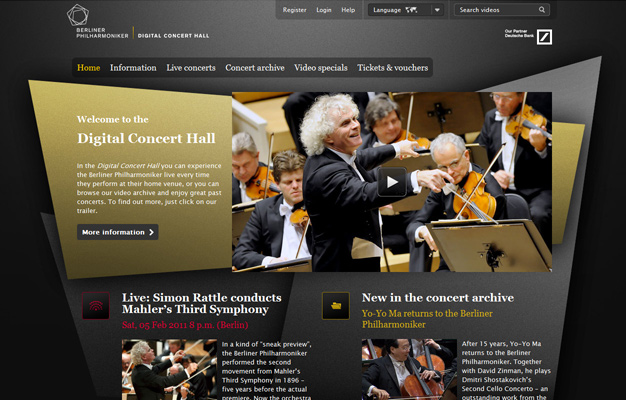
Locate an element on the screen. The height and width of the screenshot is (400, 626). music stands is located at coordinates (516, 250).